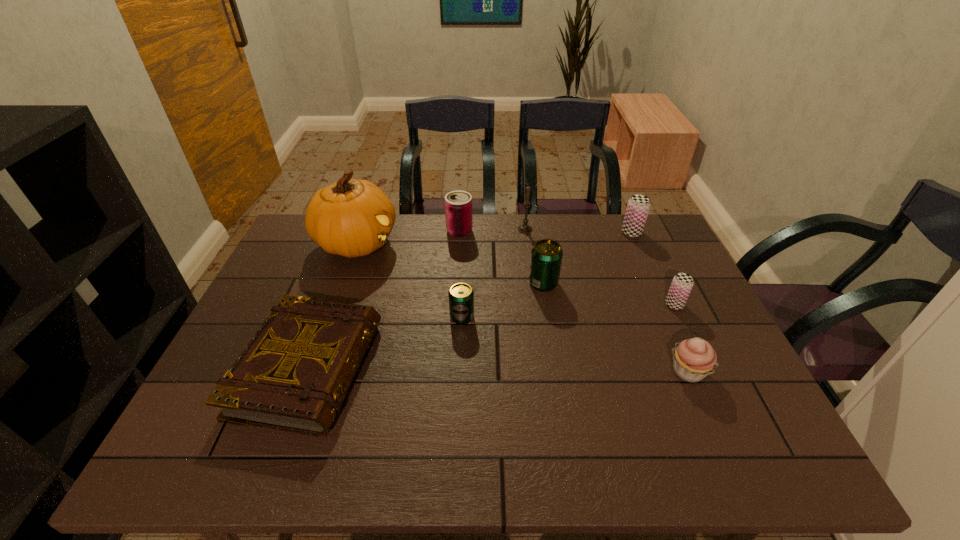
Identify the location of vacant space that is in between the leftmost beer can and the pink can. This screenshot has width=960, height=540. (461, 274).

At what (x,y) coordinates should I click in order to perform the action: click on free space that is in between the pink can and the nearer purple beer can. Please return your answer as a coordinate pair (x, y). Looking at the image, I should click on (567, 268).

I want to click on vacant area that lies between the can and the pumpkin, so click(408, 237).

The image size is (960, 540). In order to click on free space that is in between the can and the candle in this screenshot , I will do `click(492, 230)`.

Identify the location of free space between the pink cupcake and the nearer purple beer can. The width and height of the screenshot is (960, 540). (682, 338).

You are a GUI agent. You are given a task and a screenshot of the screen. Output one action in this format:
    pyautogui.click(x=<x>, y=<y>)
    Task: Click on the seventh closest object to the gray candle
    This screenshot has height=540, width=960.
    Given the screenshot: What is the action you would take?
    pyautogui.click(x=294, y=374)

You are a GUI agent. You are given a task and a screenshot of the screen. Output one action in this format:
    pyautogui.click(x=<x>, y=<y>)
    Task: Click on the object that is the eighth nearest to the nearer purple beer can
    This screenshot has width=960, height=540.
    Given the screenshot: What is the action you would take?
    pyautogui.click(x=352, y=218)

Locate an element on the screen. beer can object that ranks as the closest to the gray candle is located at coordinates (546, 255).

In order to click on beer can that is the third closest to the bigger purple beer can in this screenshot , I will do `click(461, 296)`.

Find the location of a particular element. This screenshot has width=960, height=540. free space in the image that satisfies the following two spatial constraints: 1. on the front side of the cupcake; 2. on the left side of the leftmost beer can is located at coordinates (460, 372).